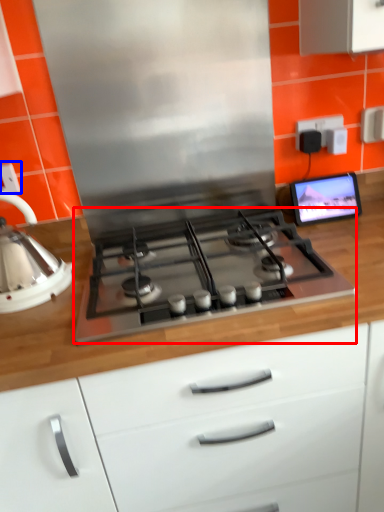
Question: Which of the following is the closest to the observer, gas stove (highlighted by a red box) or electric outlet (highlighted by a blue box)?

Choices:
 (A) gas stove
 (B) electric outlet

Answer: (A)